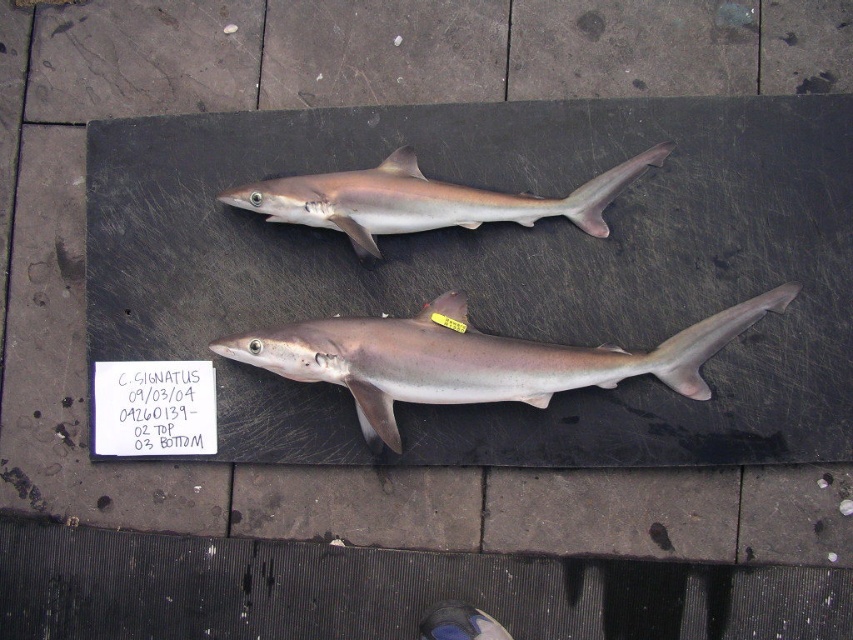
You are an artist holding a pencil and want to draw the white paper at center before drawing the smooth gray shark at center. Based on their positions, which object should you draw first to avoid covering the other?

You should draw the smooth gray shark at center first because it is to the right of the white paper at center, so drawing the white paper at center first would prevent covering the shark when working from left to right.

You are an artist trying to draw the scene shown. You have a white paper at center and a smooth gray shark at upper center. Which object should you focus on first if you want to capture the wider object in your drawing?

The smooth gray shark at upper center is wider than the white paper at center, so you should focus on drawing the smooth gray shark at upper center first to capture its width accurately.

You are standing in front of an image of two sharks on a slate surface. The sharks are positioned horizontally with their heads pointing to the left. You see a point labeled at coordinates (x=422, y=198). Which shark does this point correspond to?

The point labeled at coordinates (x=422, y=198) corresponds to the smooth gray shark at upper center.